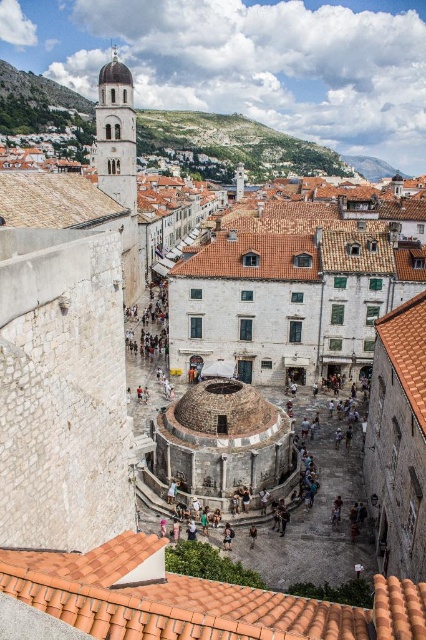
You are standing in the historic town square and want to take a photo of both the point at coordinates (423, 412) and the point at (249, 531). Since you want both points in focus, you need to know which one is closer to you. Can you tell me which point is nearer?

Point at coordinates (423, 412) is closer to the viewer than point at (249, 531).

You are standing in the central square of the historic town looking towards the iconic bell tower. You notice a terracotta tiled roof at upper left. Based on its coordinates, where exactly is the terracotta tiled roof located in relation to the central square?

The terracotta tiled roof at upper left is located at coordinates point (54,200), which places it in the upper left quadrant of the central square area.